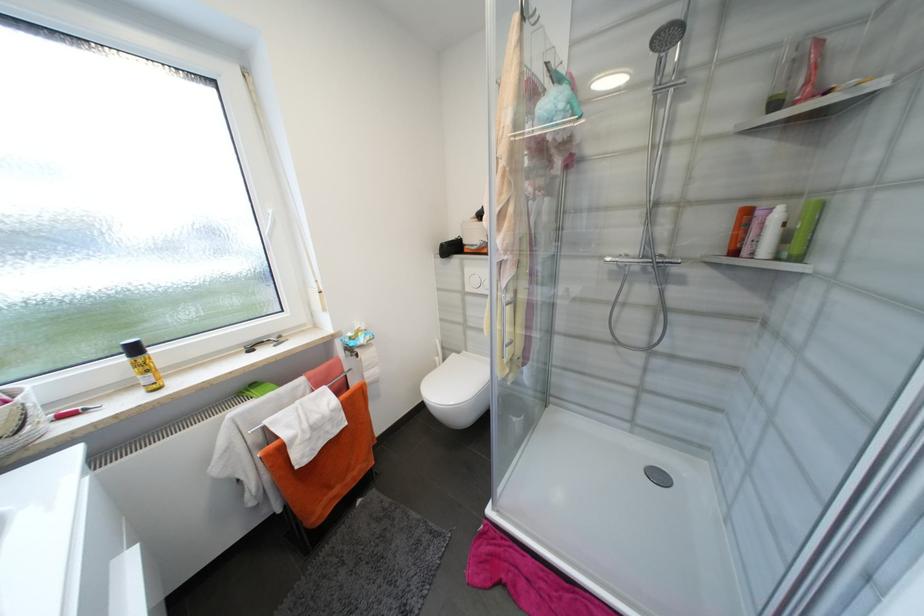
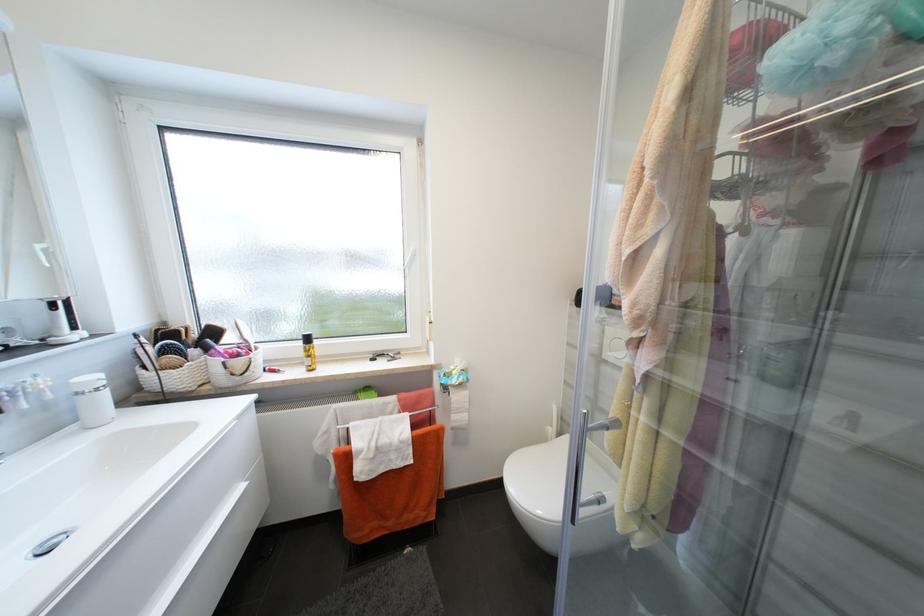
Question: How did the camera likely rotate?

Choices:
 (A) Left
 (B) Right
 (C) Up
 (D) Down

Answer: (A)